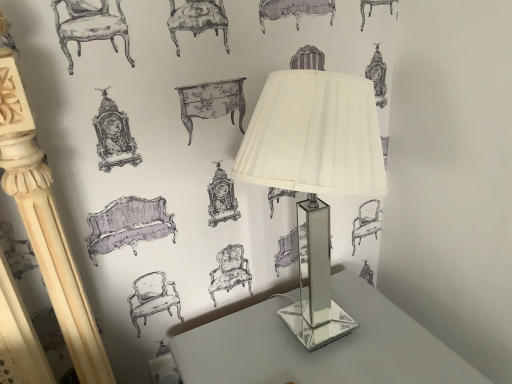
Question: In terms of size, does clear glass table at center appear bigger or smaller than clear glass lamp at center?

Choices:
 (A) small
 (B) big

Answer: (B)

Question: Is clear glass table at center inside the boundaries of clear glass lamp at center, or outside?

Choices:
 (A) inside
 (B) outside

Answer: (B)

Question: Is clear glass table at center in front of or behind clear glass lamp at center in the image?

Choices:
 (A) front
 (B) behind

Answer: (B)

Question: Considering the positions of point (352, 77) and point (248, 322), is point (352, 77) closer or farther from the camera than point (248, 322)?

Choices:
 (A) farther
 (B) closer

Answer: (B)

Question: Is clear glass lamp at center spatially inside clear glass table at center, or outside of it?

Choices:
 (A) inside
 (B) outside

Answer: (B)

Question: From the image's perspective, is clear glass lamp at center positioned above or below clear glass table at center?

Choices:
 (A) below
 (B) above

Answer: (B)

Question: Relative to clear glass table at center, is clear glass lamp at center in front or behind?

Choices:
 (A) behind
 (B) front

Answer: (B)